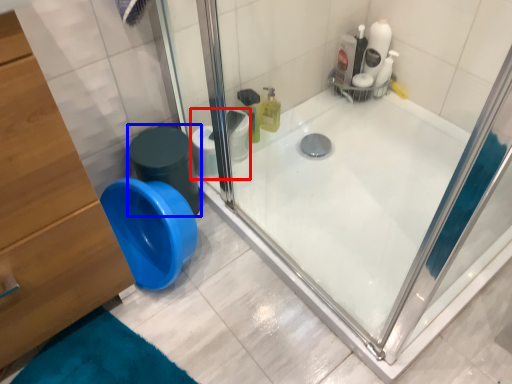
Question: Which of the following is the farthest to the observer, toilet paper (highlighted by a red box) or potty (highlighted by a blue box)?

Choices:
 (A) toilet paper
 (B) potty

Answer: (A)